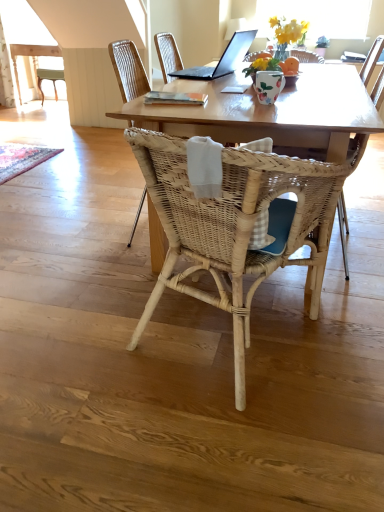
What do you see at coordinates (31, 56) in the screenshot? This screenshot has width=384, height=512. I see `light wood table at upper left` at bounding box center [31, 56].

Describe the element at coordinates (268, 86) in the screenshot. I see `floral ceramic vase at upper center` at that location.

Find the location of a particular element. rustic woven mat at lower left is located at coordinates pos(22,159).

Find the location of a particular element. woven wood chair at center, which is counted as the second chair, starting from the front is located at coordinates (128, 70).

You are a GUI agent. You are given a task and a screenshot of the screen. Output one action in this format:
    pyautogui.click(x=<x>, y=<y>)
    Task: Click on the light wood table at upper left
    
    Given the screenshot: What is the action you would take?
    pyautogui.click(x=31, y=56)

Which of these two, rustic woven mat at lower left or natural wood table at center, is wider?

natural wood table at center is wider.

Which object is more forward, rustic woven mat at lower left or natural wood table at center?

natural wood table at center is closer to the camera.

Is rustic woven mat at lower left far from natural wood table at center?

Yes, rustic woven mat at lower left and natural wood table at center are quite far apart.

Looking at this image, from the image's perspective, is rustic woven mat at lower left located above or below natural wood table at center?

Clearly, from the image's perspective, rustic woven mat at lower left is above natural wood table at center.

Considering the relative sizes of light wood table at upper left and woven rattan chair at center in the image provided, is light wood table at upper left taller than woven rattan chair at center?

Incorrect, the height of light wood table at upper left is not larger of that of woven rattan chair at center.

How many degrees apart are the facing directions of light wood table at upper left and woven rattan chair at center?

88.8 degrees separate the facing orientations of light wood table at upper left and woven rattan chair at center.

Identify the location of table behind the woven rattan chair at center. (x=31, y=56).

From the image's perspective, is rustic woven mat at lower left on top of light wood table at upper left?

No, from the image's perspective, rustic woven mat at lower left is not above light wood table at upper left.

Is rustic woven mat at lower left in front of or behind light wood table at upper left in the image?

In the image, rustic woven mat at lower left appears in front of light wood table at upper left.

Between rustic woven mat at lower left and light wood table at upper left, which one appears on the right side from the viewer's perspective?

rustic woven mat at lower left is more to the right.

Between natural wood table at center and rustic woven mat at lower left, which one has smaller size?

Smaller between the two is rustic woven mat at lower left.

Does natural wood table at center have a lesser width compared to rustic woven mat at lower left?

No.

Is rustic woven mat at lower left surrounded by natural wood table at center?

No, rustic woven mat at lower left is not surrounded by natural wood table at center.

Is natural wood table at center wider or thinner than woven wood chair at center, which is counted as the 1th chair, starting from the back?

Clearly, natural wood table at center has more width compared to woven wood chair at center, which is counted as the 1th chair, starting from the back.

Looking at the image, does natural wood table at center seem bigger or smaller compared to woven wood chair at center, which is counted as the 1th chair, starting from the back?

Considering their sizes, natural wood table at center takes up more space than woven wood chair at center, which is counted as the 1th chair, starting from the back.

Measure the distance from natural wood table at center to woven wood chair at center, which is counted as the second chair, starting from the front.

natural wood table at center is 20.36 inches from woven wood chair at center, which is counted as the second chair, starting from the front.

Is natural wood table at center aimed at woven wood chair at center, which is counted as the second chair, starting from the front?

Yes, natural wood table at center faces towards woven wood chair at center, which is counted as the second chair, starting from the front.

From the image's perspective, is woven wood chair at center, which is counted as the 1th chair, starting from the back, located above floral ceramic vase at upper center?

No.

Which of these two, woven wood chair at center, which is counted as the second chair, starting from the front, or floral ceramic vase at upper center, is bigger?

With larger size is woven wood chair at center, which is counted as the second chair, starting from the front.

From their relative heights in the image, would you say woven wood chair at center, which is counted as the second chair, starting from the front, is taller or shorter than floral ceramic vase at upper center?

In the image, woven wood chair at center, which is counted as the second chair, starting from the front, appears to be taller than floral ceramic vase at upper center.

Is woven wood chair at center, which is counted as the second chair, starting from the front, turned away from floral ceramic vase at upper center?

woven wood chair at center, which is counted as the second chair, starting from the front, is not turned away from floral ceramic vase at upper center.

Is black matte laptop at upper center inside or outside of light wood table at upper left?

The correct answer is: outside.

From a real-world perspective, is black matte laptop at upper center located higher than light wood table at upper left?

Yes, from a real-world perspective, black matte laptop at upper center is over light wood table at upper left

Considering the relative sizes of black matte laptop at upper center and light wood table at upper left in the image provided, is black matte laptop at upper center smaller than light wood table at upper left?

Indeed, black matte laptop at upper center has a smaller size compared to light wood table at upper left.

This screenshot has height=512, width=384. Identify the location of mat behind the natural wood table at center. (22, 159).

Image resolution: width=384 pixels, height=512 pixels. I want to click on armchair that appears below the light wood table at upper left (from the image's perspective), so click(x=343, y=230).

Which object lies further to the anchor point black matte laptop at upper center, natural wood table at center or woven wood chair at center, which is counted as the second chair, starting from the front?

The object further to black matte laptop at upper center is natural wood table at center.

From the picture: Based on their spatial positions, is woven wood chair at center, which is counted as the 1th chair, starting from the back, or floral ceramic vase at upper center closer to light wood table at upper left?

woven wood chair at center, which is counted as the 1th chair, starting from the back.

When comparing their distances from natural wood table at center, does woven wood chair at center, the 2th chair positioned from the back, or woven wood chair at center, which is counted as the second chair, starting from the front, seem further?

The object further to natural wood table at center is woven wood chair at center, which is counted as the second chair, starting from the front.

Looking at the image, which one is located closer to floral ceramic vase at upper center, natural wood table at center or woven wood chair at center, the 2th chair positioned from the back?

natural wood table at center is positioned closer to the anchor floral ceramic vase at upper center.

From the image, which object appears to be farther from floral ceramic vase at upper center, natural wood table at center or woven wood chair at center, which is counted as the 1th chair, starting from the back?

woven wood chair at center, which is counted as the 1th chair, starting from the back, is positioned further to the anchor floral ceramic vase at upper center.

Considering their positions, is rustic woven mat at lower left positioned closer to natural wood table at center than black matte laptop at upper center?

black matte laptop at upper center lies closer to natural wood table at center than the other object.

When comparing their distances from light wood table at upper left, does woven rattan chair at center or woven wood chair at center, which is counted as the 1th chair, starting from the back, seem closer?

woven wood chair at center, which is counted as the 1th chair, starting from the back.

When comparing their distances from rustic woven mat at lower left, does woven wood chair at center, which is counted as the second chair, starting from the front, or woven wood chair at center, positioned as the first chair in front-to-back order, seem further?

woven wood chair at center, positioned as the first chair in front-to-back order.

This screenshot has height=512, width=384. Find the location of `coffee table located between woven wood chair at center, the 2th chair positioned from the back, and woven wood chair at center, which is counted as the 1th chair, starting from the back, in the depth direction`. coffee table located between woven wood chair at center, the 2th chair positioned from the back, and woven wood chair at center, which is counted as the 1th chair, starting from the back, in the depth direction is located at coordinates (270, 112).

Where is `mat between woven wood chair at center, the 2th chair positioned from the back, and light wood table at upper left from front to back`? mat between woven wood chair at center, the 2th chair positioned from the back, and light wood table at upper left from front to back is located at coordinates (22, 159).

Find the location of a particular element. The width and height of the screenshot is (384, 512). vase between natural wood table at center and light wood table at upper left in the front-back direction is located at coordinates (268, 86).

Locate an element on the screen. The height and width of the screenshot is (512, 384). coffee table located between woven wood chair at center, the 2th chair positioned from the back, and woven rattan chair at center in the depth direction is located at coordinates (270, 112).